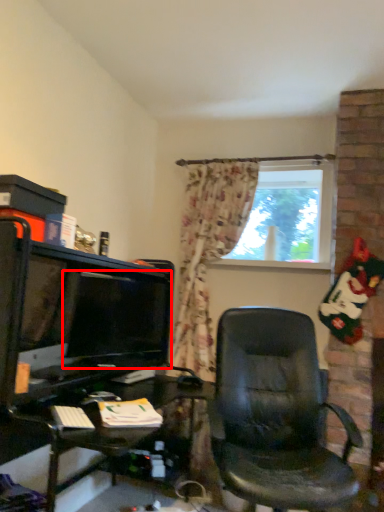
Question: From the image, what is the correct spatial relationship of computer monitor (annotated by the red box) in relation to window?

Choices:
 (A) left
 (B) right

Answer: (A)